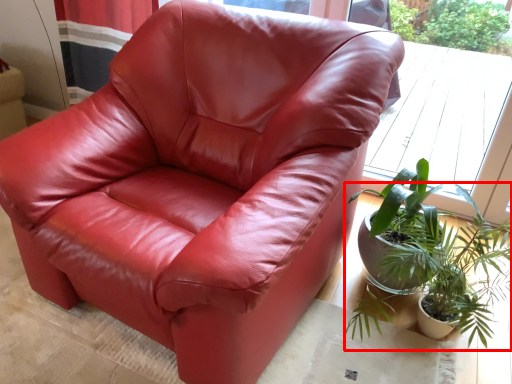
Question: From the image's perspective, where is houseplant (annotated by the red box) located relative to window?

Choices:
 (A) below
 (B) above

Answer: (A)